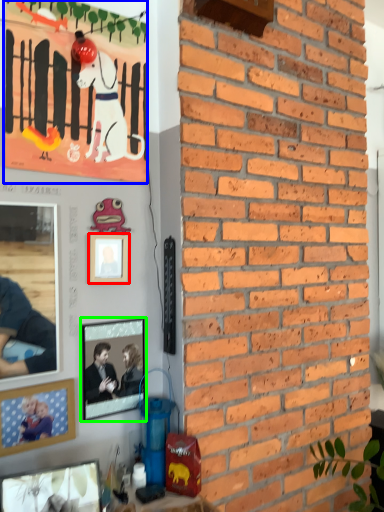
Question: Which is nearer to the picture frame (highlighted by a red box)? poster (highlighted by a blue box) or picture frame (highlighted by a green box).

Choices:
 (A) poster
 (B) picture frame

Answer: (B)